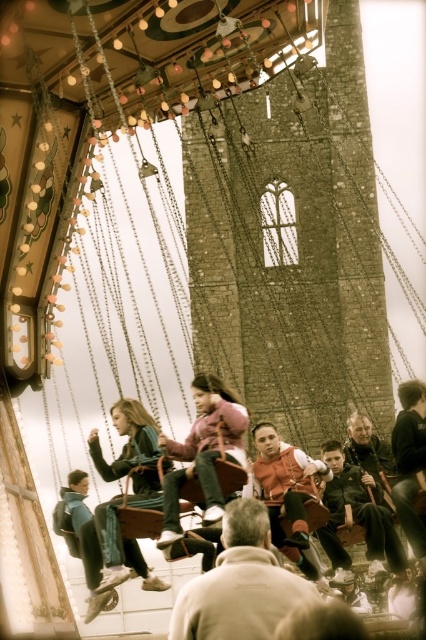
Question: Which object appears farthest from the camera in this image?

Choices:
 (A) orange fabric vest at center
 (B) dark brown leather jacket at center
 (C) matte pink sweater at center

Answer: (B)

Question: Which of these objects is positioned closest to the dark brown leather jacket at center?

Choices:
 (A) matte pink sweater at center
 (B) denim jeans at center
 (C) light brown leather jacket at center
 (D) orange fabric vest at center

Answer: (A)

Question: Considering the relative positions of pink fleece jacket at center and dark brown leather jacket at center in the image provided, where is pink fleece jacket at center located with respect to dark brown leather jacket at center?

Choices:
 (A) right
 (B) left

Answer: (B)

Question: Which object is the closest to the dark brown leather jacket at center?

Choices:
 (A) pink fleece jacket at center
 (B) denim jeans at center

Answer: (A)

Question: Does denim jeans at center appear on the right side of dark brown leather jacket at center?

Choices:
 (A) yes
 (B) no

Answer: (B)

Question: Does pink fleece jacket at center have a larger size compared to dark brown leather jacket at center?

Choices:
 (A) no
 (B) yes

Answer: (B)